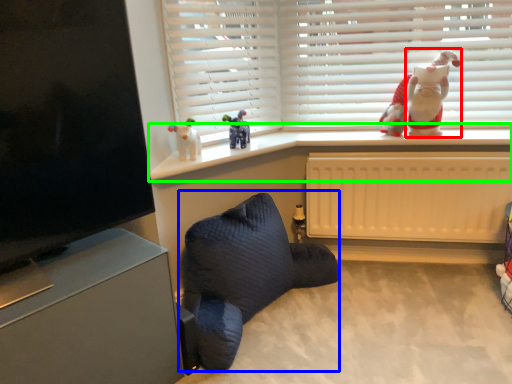
Question: Which object is positioned closest to santa claus (highlighted by a red box)? Select from bean bag chair (highlighted by a blue box) and window sill (highlighted by a green box).

Choices:
 (A) bean bag chair
 (B) window sill

Answer: (B)